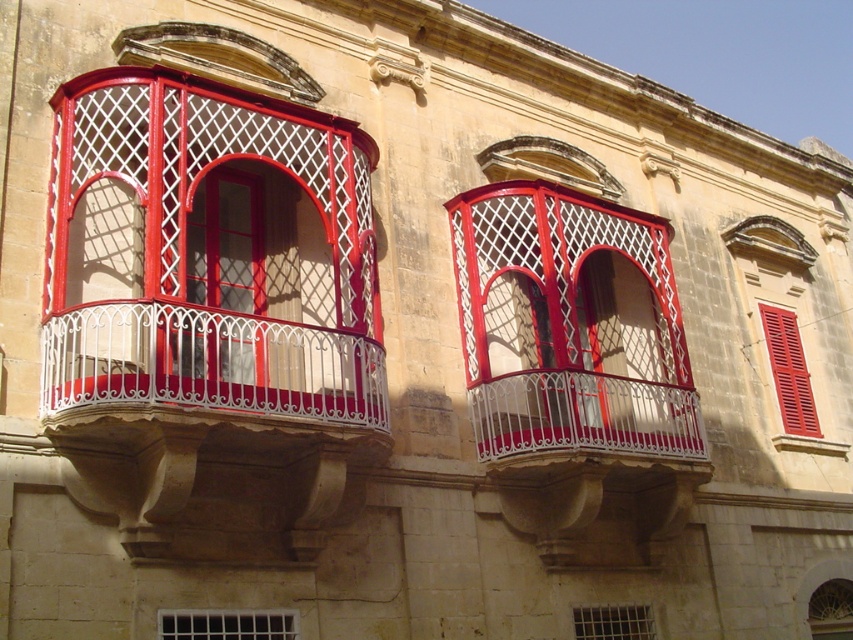
Question: Can you confirm if white wrought iron balcony at center is positioned below clear glass window at lower center?

Choices:
 (A) no
 (B) yes

Answer: (A)

Question: Considering the real-world distances, which object is farthest from the clear glass fan at center?

Choices:
 (A) clear glass window at lower center
 (B) white wrought iron balcony at center

Answer: (A)

Question: Observing the image, what is the correct spatial positioning of matte white wrought iron balcony at left in reference to white wrought iron balcony at center?

Choices:
 (A) below
 (B) above

Answer: (B)

Question: Among these points, which one is nearest to the camera?

Choices:
 (A) (612, 618)
 (B) (492, 438)
 (C) (776, 326)
 (D) (653, 442)

Answer: (B)

Question: Which of the following is the farthest from the observer?

Choices:
 (A) clear glass window at lower center
 (B) metallic grid at lower center
 (C) clear glass fan at center

Answer: (C)

Question: Where is matte red shutter at upper right located in relation to metallic grid at lower center in the image?

Choices:
 (A) right
 (B) left

Answer: (A)